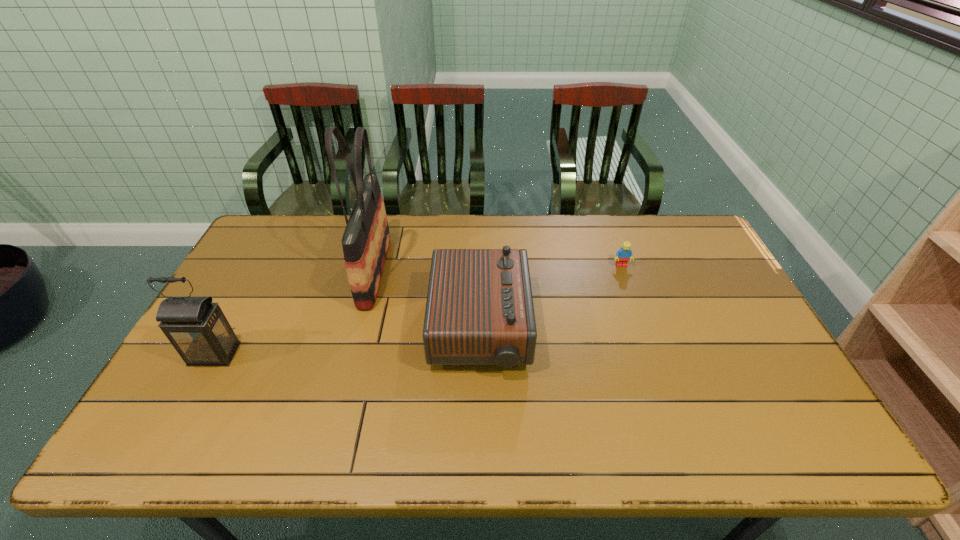
I want to click on free spot that satisfies the following two spatial constraints: 1. on the front-facing side of the shopping bag; 2. on the front-facing side of the third shortest object, so click(x=353, y=354).

At what (x,y) coordinates should I click in order to perform the action: click on vacant point that satisfies the following two spatial constraints: 1. on the front panel of the third tallest object; 2. on the front-facing side of the third shortest object. Please return your answer as a coordinate pair (x, y). This screenshot has width=960, height=540. Looking at the image, I should click on pos(480,354).